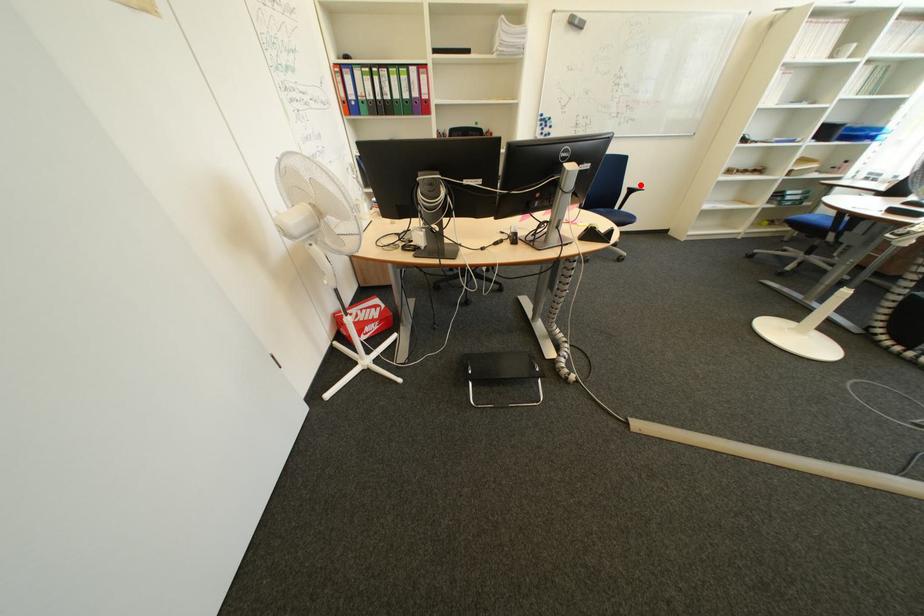
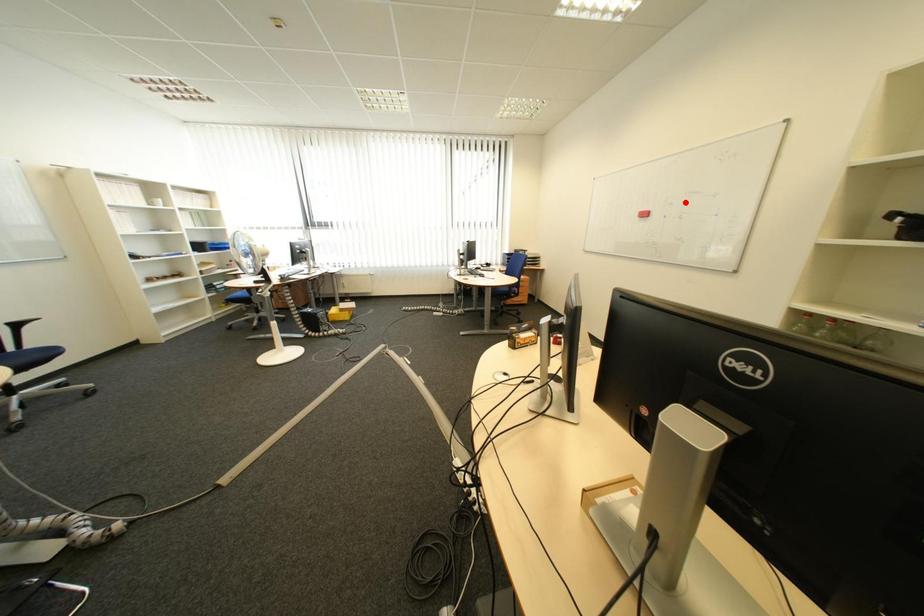
I am providing you with two images of the same scene from different viewpoints. A red point is marked on the first image and another point is marked on the second image. Do the highlighted points in image1 and image2 indicate the same real-world spot?

No